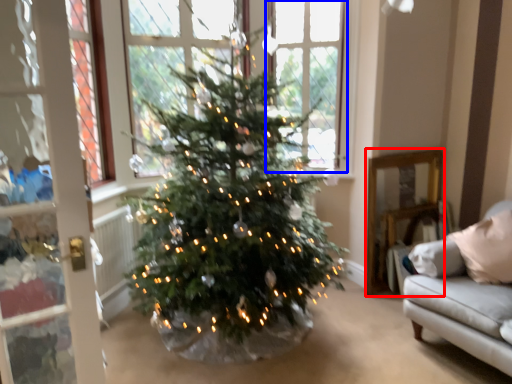
Question: Which point is further to the camera, furniture (highlighted by a red box) or window (highlighted by a blue box)?

Choices:
 (A) furniture
 (B) window

Answer: (A)